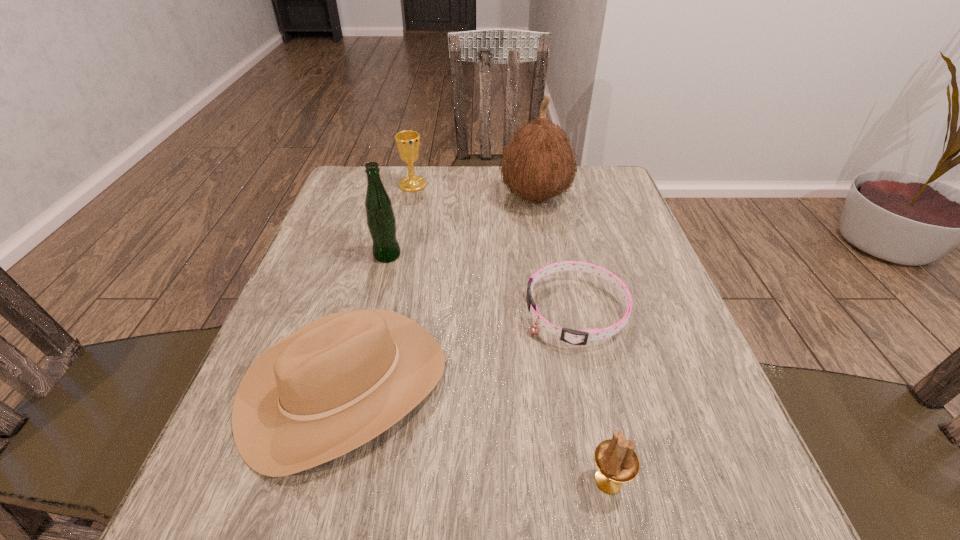
Where is `cowboy hat at the near edge`? This screenshot has width=960, height=540. cowboy hat at the near edge is located at coordinates (338, 382).

In order to click on beer bottle at the left edge in this screenshot , I will do `click(381, 221)`.

The image size is (960, 540). I want to click on cowboy hat that is positioned at the left edge, so click(338, 382).

Identify the location of coconut located in the right edge section of the desktop. The width and height of the screenshot is (960, 540). (538, 163).

Locate an element on the screen. This screenshot has width=960, height=540. dog collar located at the right edge is located at coordinates (576, 337).

At what (x,y) coordinates should I click in order to perform the action: click on object that is at the near left corner. Please return your answer as a coordinate pair (x, y). Looking at the image, I should click on (338, 382).

Identify the location of object present at the far right corner. The height and width of the screenshot is (540, 960). (538, 163).

Find the location of a particular element. free spot at the far edge of the desktop is located at coordinates (533, 204).

Identify the location of free location at the near edge. (549, 485).

Where is `vacant area at the left edge of the desktop`? This screenshot has width=960, height=540. vacant area at the left edge of the desktop is located at coordinates (218, 451).